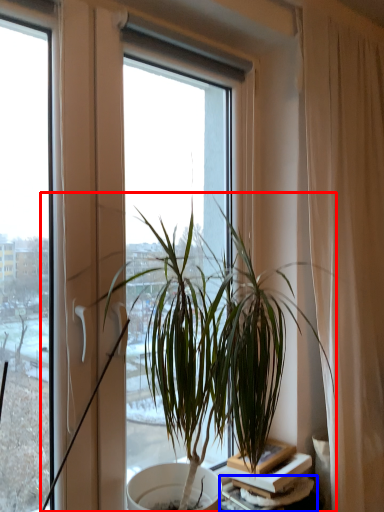
Question: Which point is further to the camera, houseplant (highlighted by a red box) or table (highlighted by a blue box)?

Choices:
 (A) houseplant
 (B) table

Answer: (B)